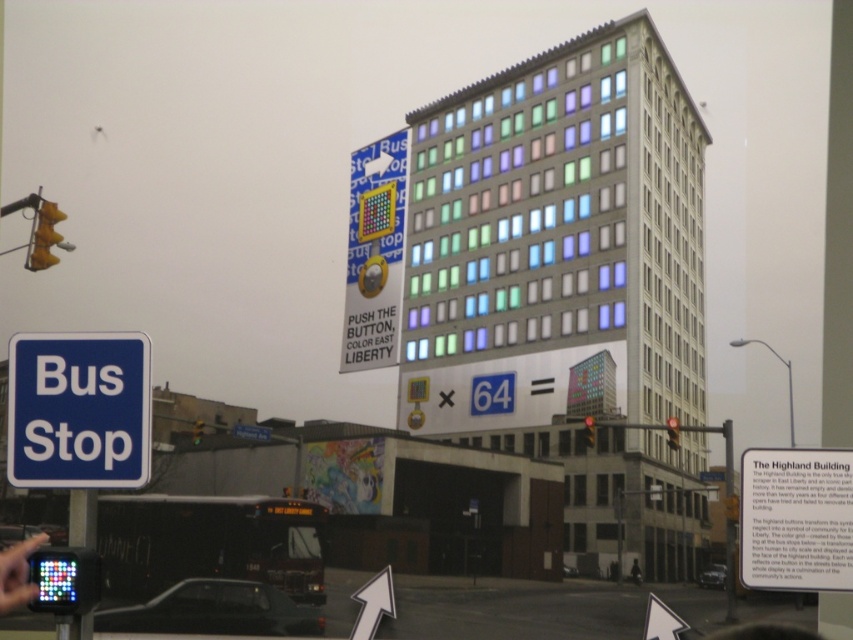
Question: Is red glass traffic light at center smaller than yellow matte traffic light at upper left?

Choices:
 (A) no
 (B) yes

Answer: (A)

Question: Which object is the closest to the red glass traffic light at upper right?

Choices:
 (A) blue plastic bus stop sign at lower left
 (B) blue plastic bus stop at lower left
 (C) yellow plastic traffic light at upper left

Answer: (A)

Question: Estimate the real-world distances between objects in this image. Which object is closer to the blue plastic bus stop sign at lower left?

Choices:
 (A) yellow plastic traffic light at upper left
 (B) red glass traffic light at upper right
 (C) red glass traffic light at center
 (D) black matte person at lower right

Answer: (A)

Question: Is red glass traffic light at upper right below yellow matte traffic light at upper left?

Choices:
 (A) yes
 (B) no

Answer: (A)

Question: Where is yellow plastic traffic light at upper left located in relation to yellow matte traffic light at upper left in the image?

Choices:
 (A) below
 (B) above

Answer: (B)

Question: Which object appears closest to the camera in this image?

Choices:
 (A) yellow plastic traffic light at upper left
 (B) yellow matte traffic light at upper left
 (C) blue plastic bus stop sign at lower left

Answer: (B)